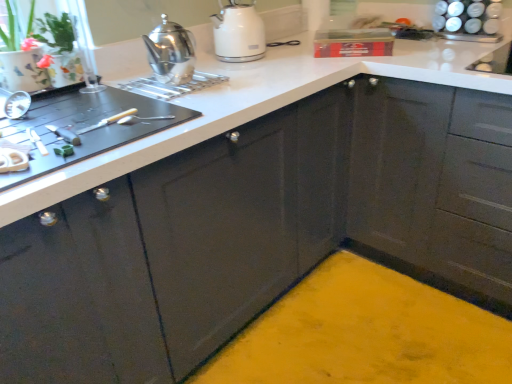
Question: Is glossy dark gray cabinet at upper right thinner than polished stainless steel teapot at upper left, arranged as the 2th kitchen appliance when viewed from the back?

Choices:
 (A) no
 (B) yes

Answer: (A)

Question: Is glossy dark gray cabinet at upper right facing away from polished stainless steel teapot at upper left, which is counted as the second kitchen appliance, starting from the right?

Choices:
 (A) no
 (B) yes

Answer: (A)

Question: Is glossy dark gray cabinet at upper right further to camera compared to polished stainless steel teapot at upper left, which is counted as the second kitchen appliance, starting from the right?

Choices:
 (A) no
 (B) yes

Answer: (A)

Question: Is glossy dark gray cabinet at upper right not near polished stainless steel teapot at upper left, arranged as the 2th kitchen appliance when viewed from the back?

Choices:
 (A) yes
 (B) no

Answer: (B)

Question: Does glossy dark gray cabinet at upper right have a greater width compared to polished stainless steel teapot at upper left, arranged as the 2th kitchen appliance when viewed from the back?

Choices:
 (A) yes
 (B) no

Answer: (A)

Question: Is polished stainless steel teapot at upper left, which is counted as the second kitchen appliance, starting from the right, a part of glossy dark gray cabinet at upper right?

Choices:
 (A) yes
 (B) no

Answer: (B)

Question: Is white glossy countertop at center not close to polished stainless steel teapot at upper left, arranged as the first kitchen appliance when viewed from the front?

Choices:
 (A) yes
 (B) no

Answer: (B)

Question: Can you confirm if white glossy countertop at center is smaller than polished stainless steel teapot at upper left, which appears as the 1th kitchen appliance when viewed from the left?

Choices:
 (A) yes
 (B) no

Answer: (B)

Question: From a real-world perspective, does white glossy countertop at center sit lower than polished stainless steel teapot at upper left, arranged as the 2th kitchen appliance when viewed from the back?

Choices:
 (A) no
 (B) yes

Answer: (B)

Question: From the image's perspective, does white glossy countertop at center appear higher than polished stainless steel teapot at upper left, arranged as the 2th kitchen appliance when viewed from the back?

Choices:
 (A) yes
 (B) no

Answer: (B)

Question: Is white glossy countertop at center at the right side of polished stainless steel teapot at upper left, which appears as the 1th kitchen appliance when viewed from the left?

Choices:
 (A) yes
 (B) no

Answer: (A)

Question: Is white glossy countertop at center looking in the opposite direction of polished stainless steel teapot at upper left, arranged as the 2th kitchen appliance when viewed from the back?

Choices:
 (A) yes
 (B) no

Answer: (B)

Question: Could you tell me if polished stainless steel teapot at upper left, which is counted as the second kitchen appliance, starting from the right, is turned towards textured ceramic pot at upper left?

Choices:
 (A) no
 (B) yes

Answer: (A)